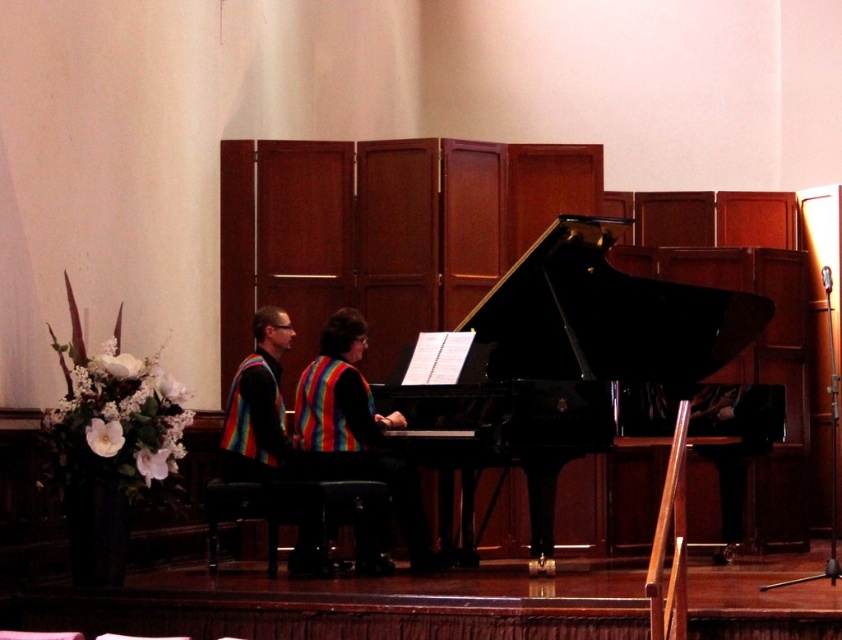
You are sitting in the audience and notice the black polished piano at center and the rainbow fabric vest at center. Which object is closer to you?

The black polished piano at center is closer to the viewer than the rainbow fabric vest at center.

You are sitting in the audience and looking towards the stage. Which object is closer to you between the black polished piano at center and the rainbow striped vest at center?

The black polished piano at center is closer to the viewer than the rainbow striped vest at center.